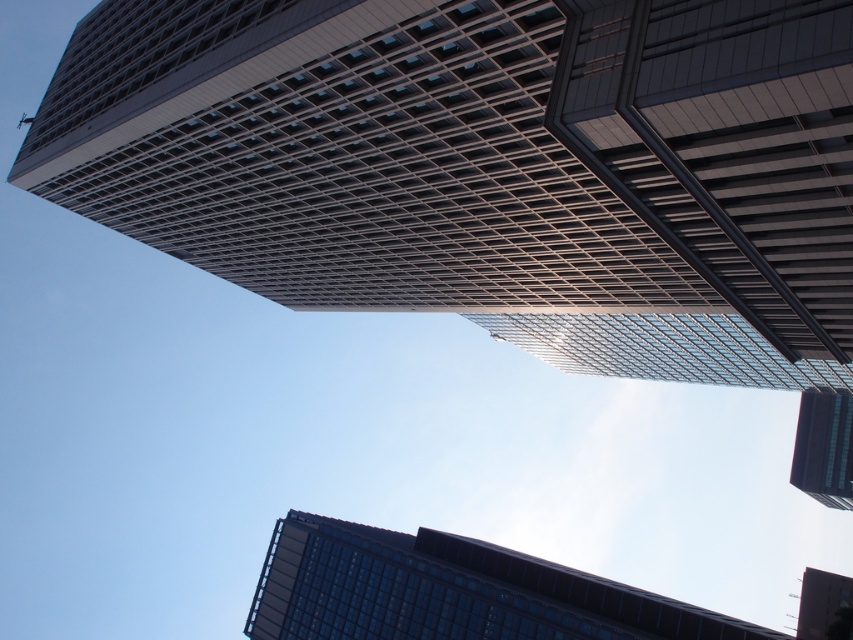
Question: Can you confirm if metallic glass skyscraper at upper center is positioned below dark glass skyscraper at lower center?

Choices:
 (A) no
 (B) yes

Answer: (A)

Question: Estimate the real-world distances between objects in this image. Which object is closer to the dark glass skyscraper at lower center?

Choices:
 (A) glassy reflective tower at upper center
 (B) glassy reflective skyscraper at upper right
 (C) metallic glass skyscraper at upper center

Answer: (A)

Question: Can you confirm if metallic glass skyscraper at upper center is thinner than glassy reflective tower at upper center?

Choices:
 (A) no
 (B) yes

Answer: (A)

Question: Which object is positioned closest to the dark glass skyscraper at lower center?

Choices:
 (A) glassy reflective tower at upper center
 (B) glassy reflective skyscraper at upper right
 (C) metallic glass skyscraper at upper center

Answer: (A)

Question: From the image, what is the correct spatial relationship of metallic glass skyscraper at upper center in relation to glassy reflective skyscraper at upper right?

Choices:
 (A) above
 (B) below

Answer: (A)

Question: Which of the following is the closest to the observer?

Choices:
 (A) (811, 433)
 (B) (665, 177)
 (C) (289, 592)
 (D) (825, 604)

Answer: (B)